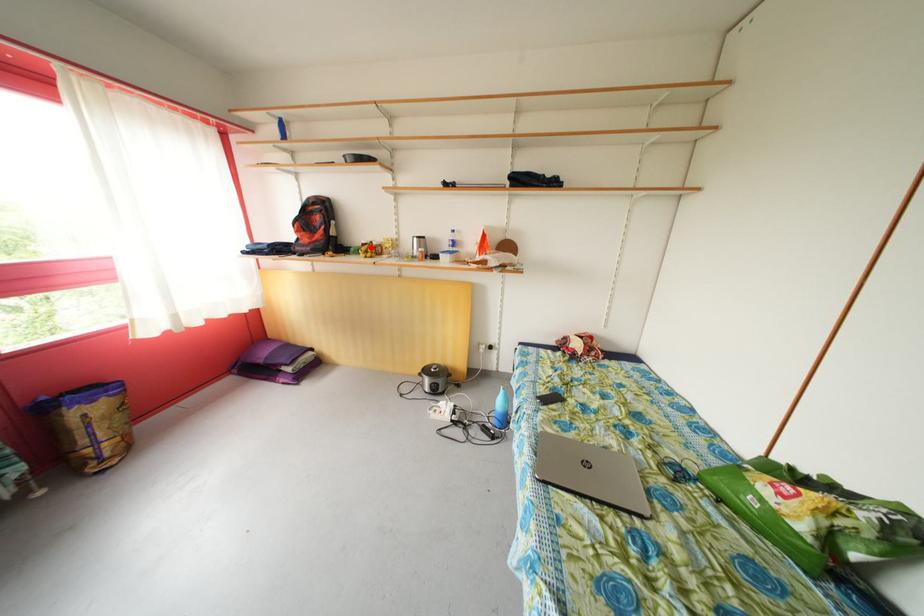
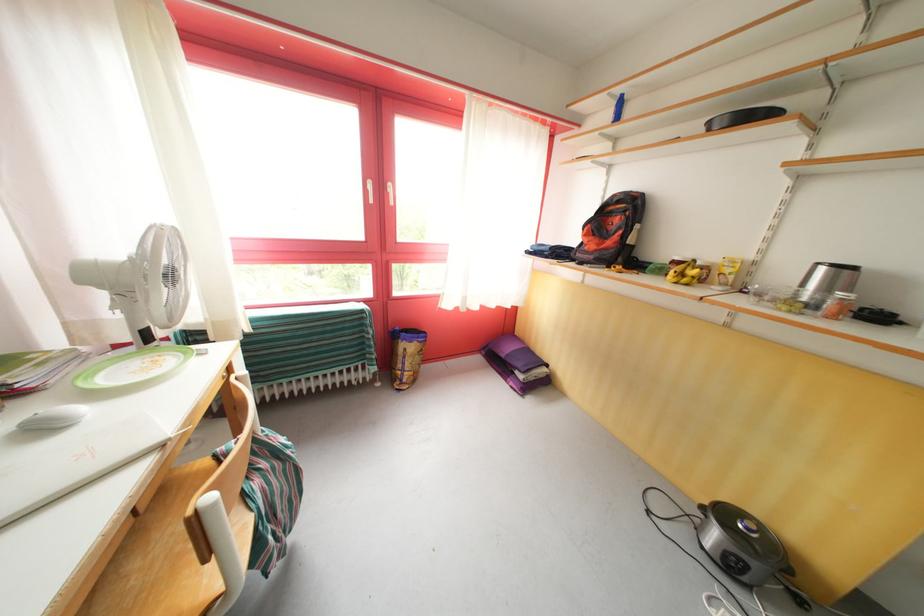
Where in the second image is the point corresponding to the highlighted location from the first image?

(684, 264)